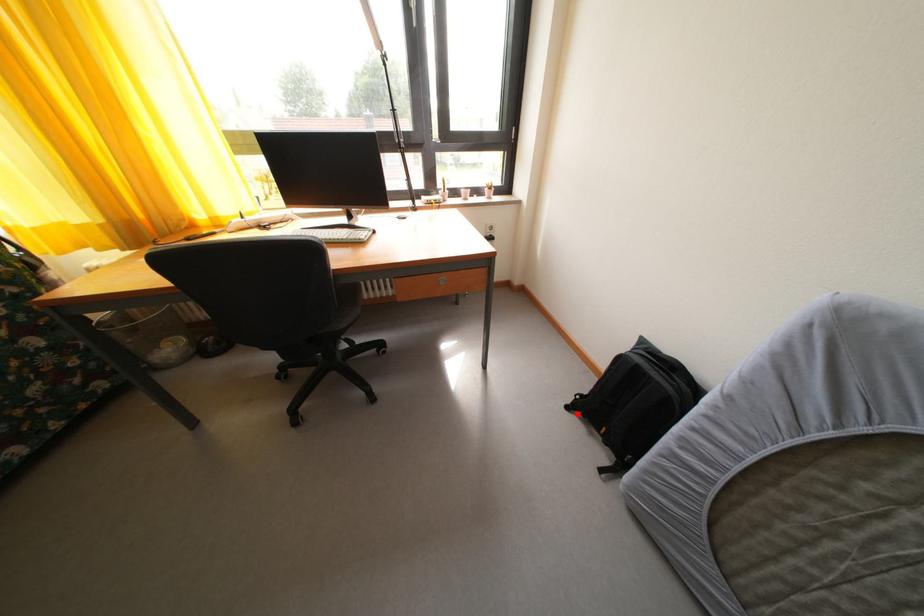
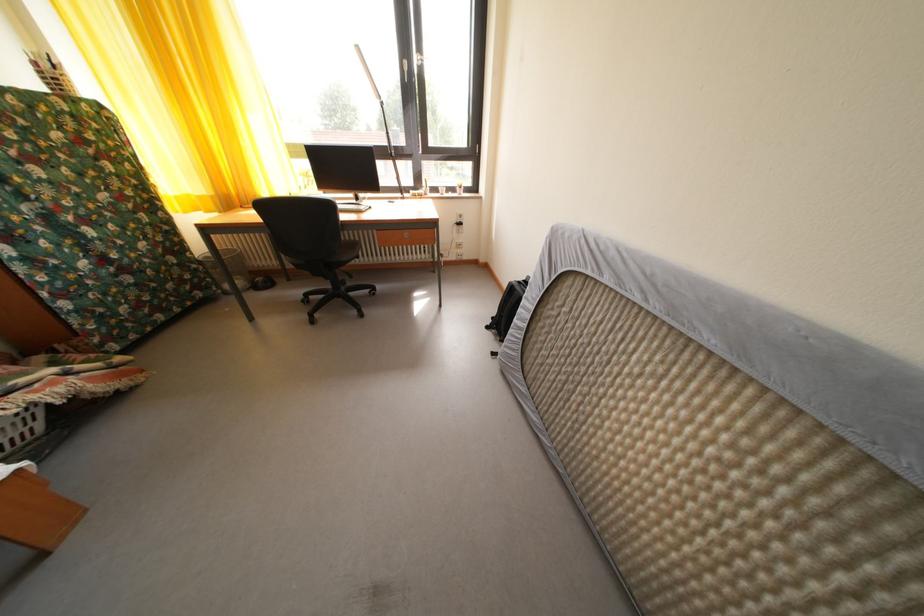
Locate, in the second image, the point that corresponds to the highlighted location in the first image.

(496, 334)